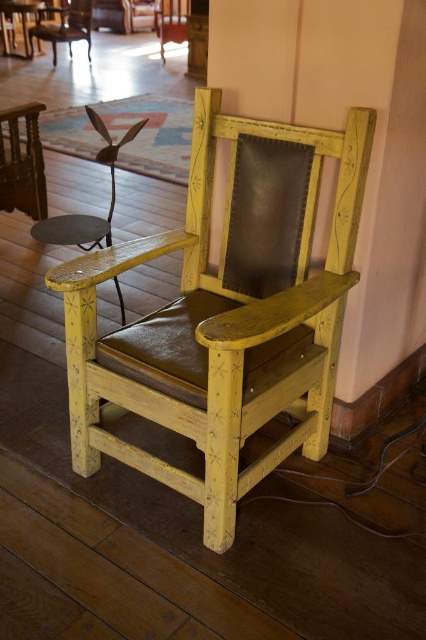
Can you confirm if yellow painted wood chair at center is positioned to the left of yellow painted wood armchair at center?

Incorrect, yellow painted wood chair at center is not on the left side of yellow painted wood armchair at center.

Between yellow painted wood chair at center and yellow painted wood armchair at center, which one has more height?

Standing taller between the two is yellow painted wood chair at center.

This screenshot has width=426, height=640. I want to click on yellow painted wood chair at center, so click(x=224, y=314).

Find the location of a particular element. This screenshot has height=640, width=426. yellow painted wood chair at center is located at coordinates (224, 314).